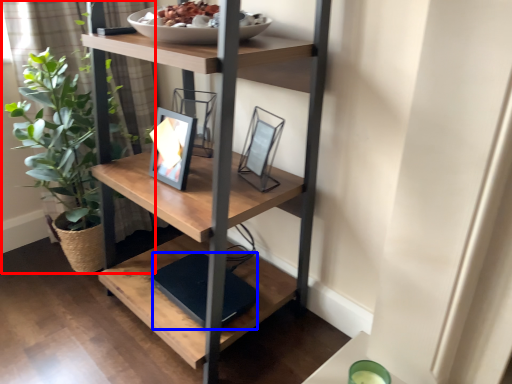
Question: Among these objects, which one is nearest to the camera, houseplant (highlighted by a red box) or lift (highlighted by a blue box)?

Choices:
 (A) houseplant
 (B) lift

Answer: (B)